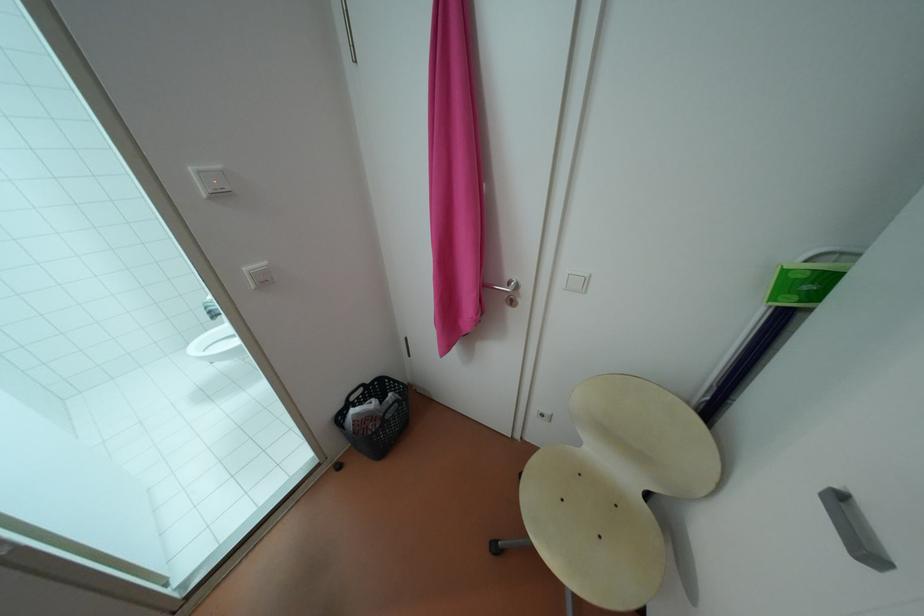
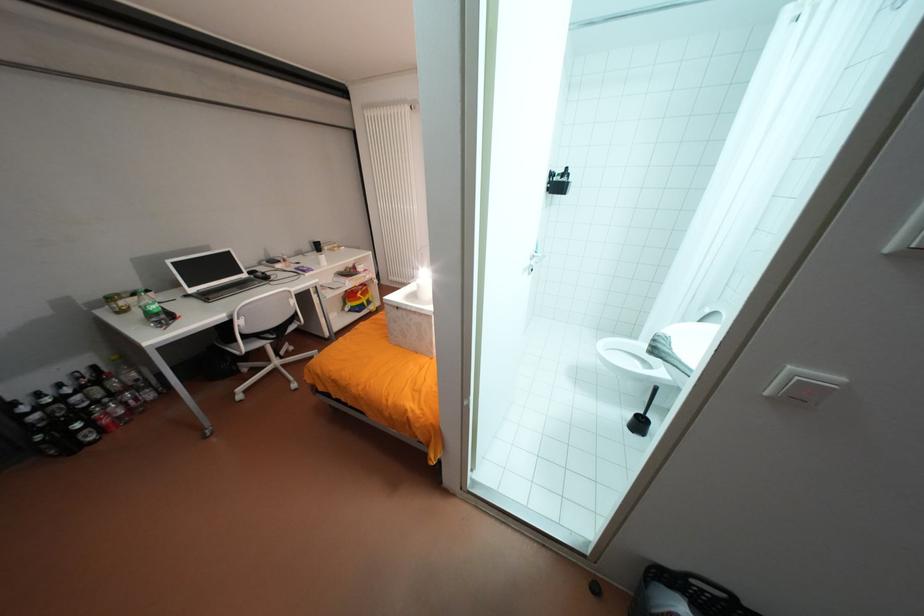
In the second image, find the point that corresponds to (x=220, y=307) in the first image.

(669, 345)